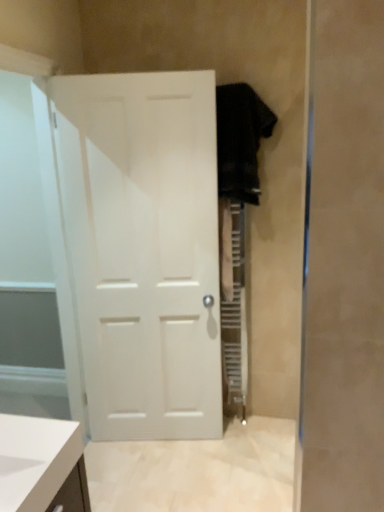
You are a GUI agent. You are given a task and a screenshot of the screen. Output one action in this format:
    pyautogui.click(x=<x>, y=<y>)
    Task: Click on the vacant area to the right of white matte door at center
    The image size is (384, 512).
    Given the screenshot: What is the action you would take?
    pyautogui.click(x=242, y=451)